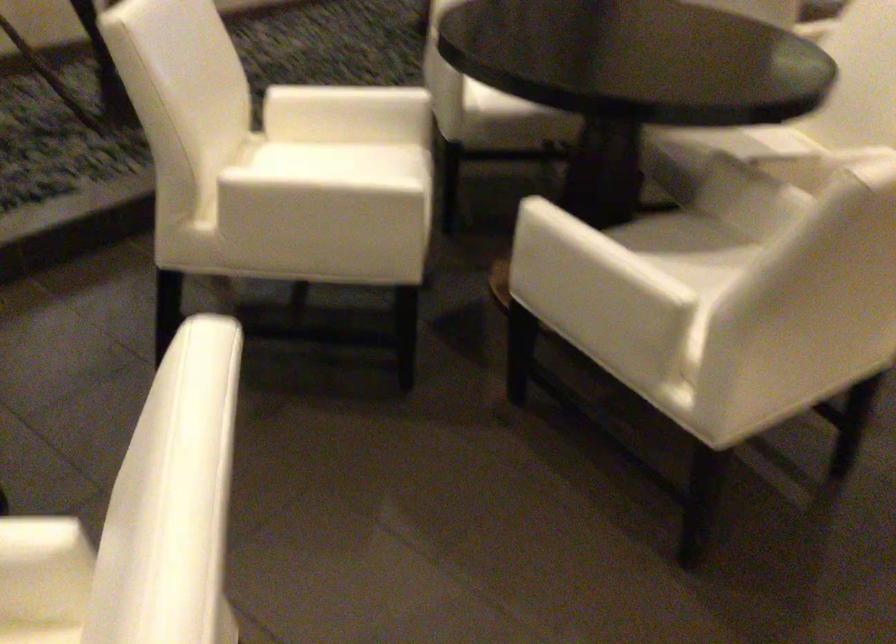
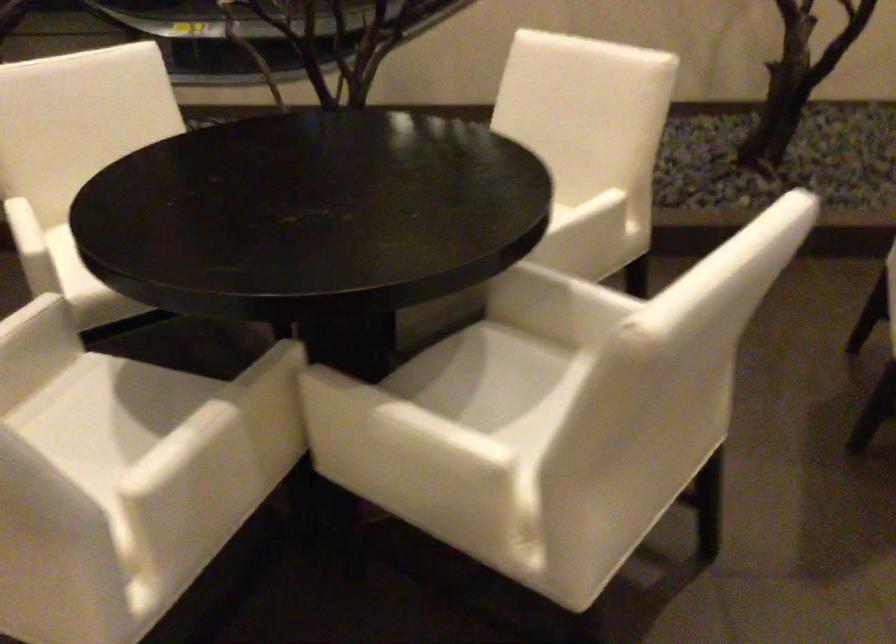
Locate, in the second image, the point that corresponds to point (764, 187) in the first image.

(271, 408)